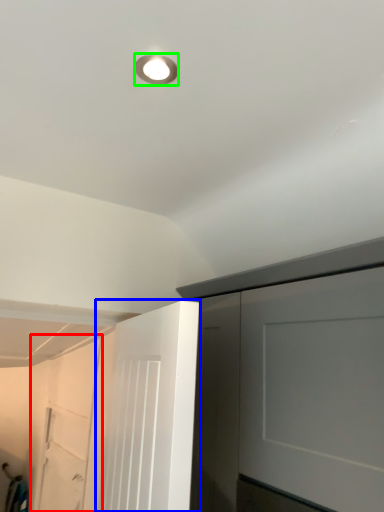
Question: Estimate the real-world distances between objects in this image. Which object is farther from garage door (highlighted by a red box), door (highlighted by a blue box) or droplight (highlighted by a green box)?

Choices:
 (A) door
 (B) droplight

Answer: (B)